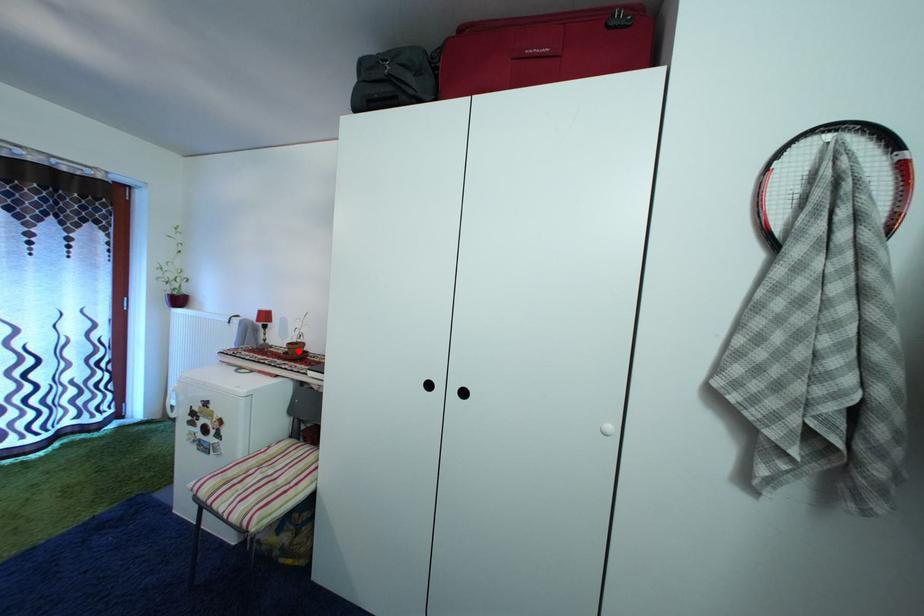
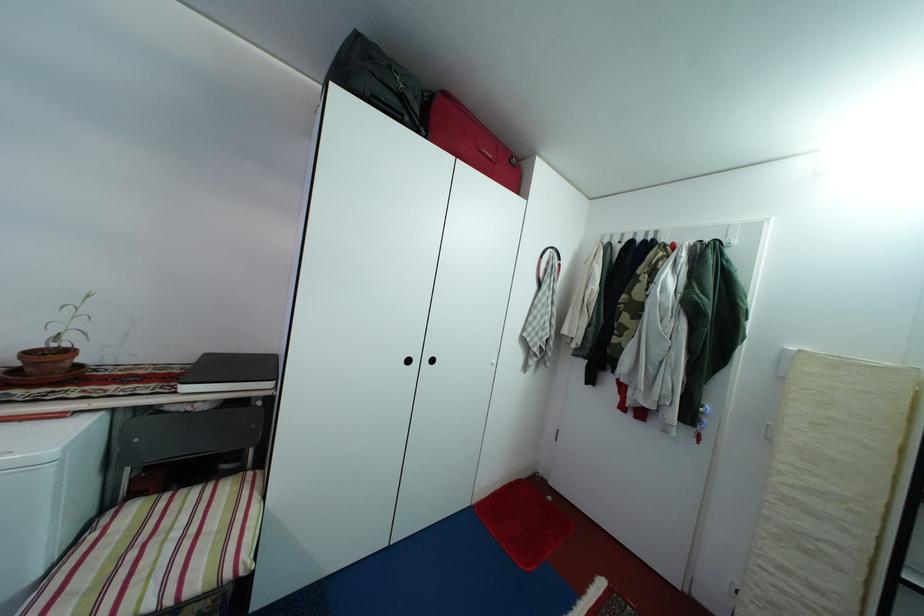
Question: I am providing you with two images of the same scene from different viewpoints. Given a red point in image1, look at the same physical point in image2. Is it:

Choices:
 (A) Closer to the viewpoint
 (B) Farther from the viewpoint

Answer: (A)